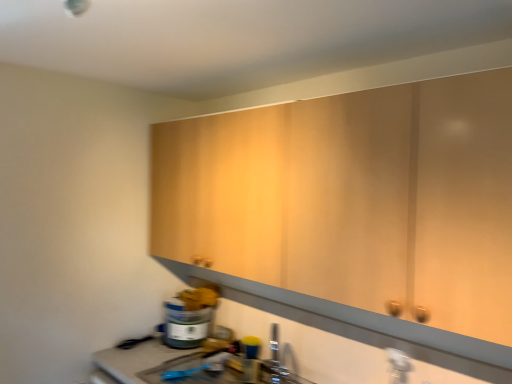
The image size is (512, 384). I want to click on matte plastic container at lower left, so click(x=189, y=318).

This screenshot has height=384, width=512. What do you see at coordinates (189, 318) in the screenshot?
I see `matte plastic container at lower left` at bounding box center [189, 318].

This screenshot has height=384, width=512. Identify the location of matte plastic container at lower left. (189, 318).